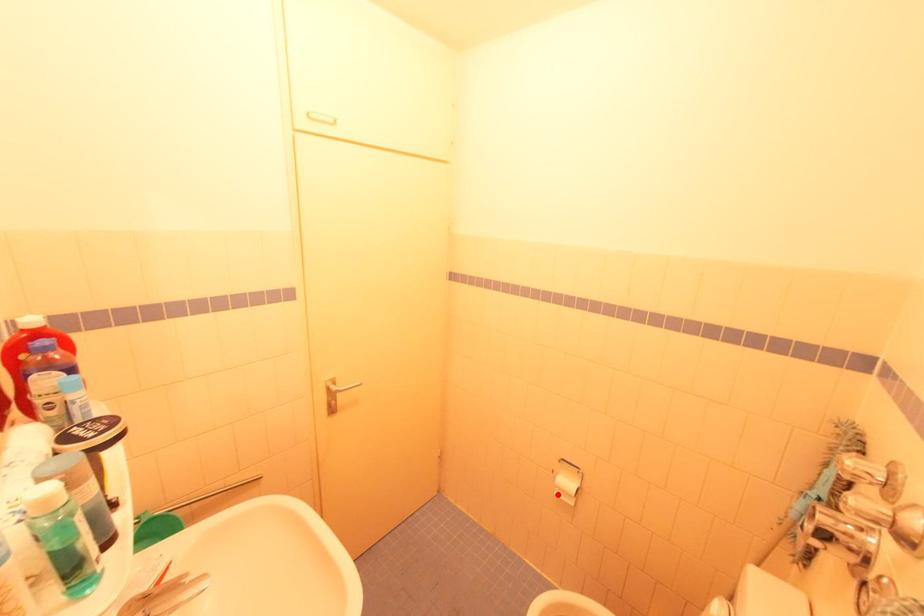
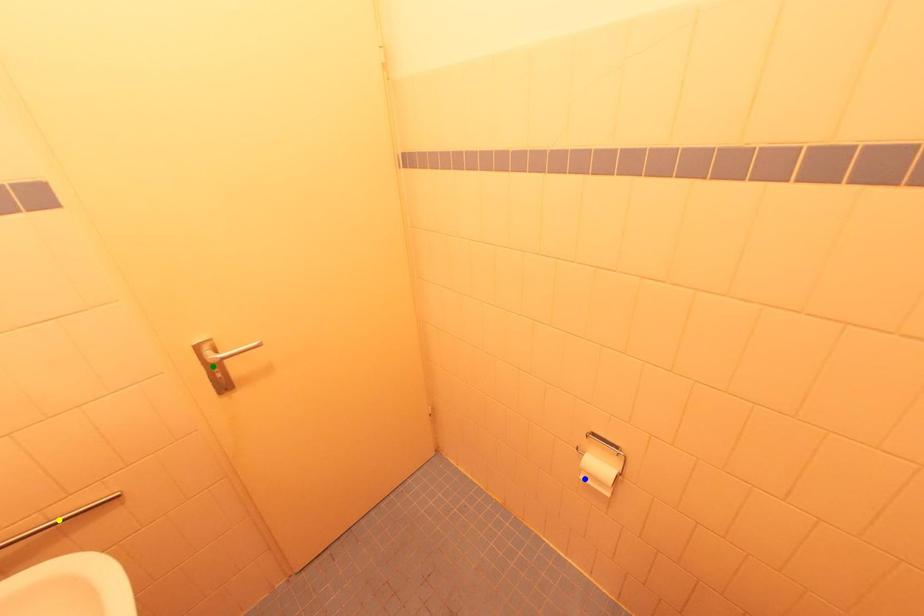
Question: I am providing you with two images of the same scene from different viewpoints. A red point is marked on the first image. You are given multiple points on the second image. Which point in image 2 is actually the same real-world point as the red point in image 1?

Choices:
 (A) yellow point
 (B) green point
 (C) blue point

Answer: (C)